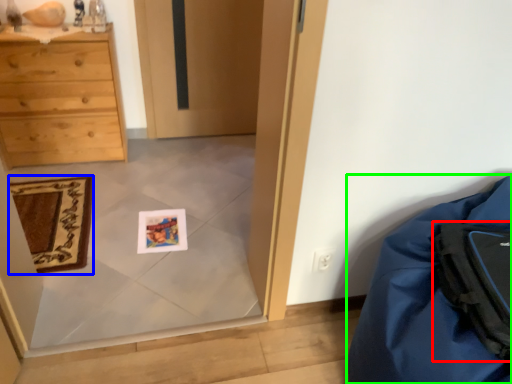
Question: Considering the real-world distances, which object is closest to backpack (highlighted by a red box)? mat (highlighted by a blue box) or furniture (highlighted by a green box).

Choices:
 (A) mat
 (B) furniture

Answer: (B)